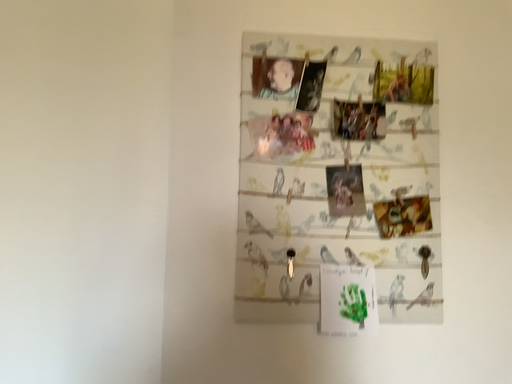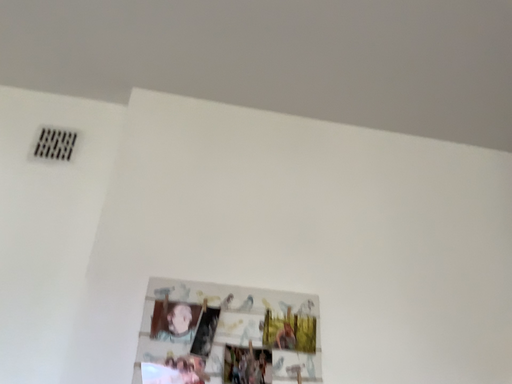
Question: Which way did the camera rotate in the video?

Choices:
 (A) rotated left
 (B) rotated right

Answer: (B)